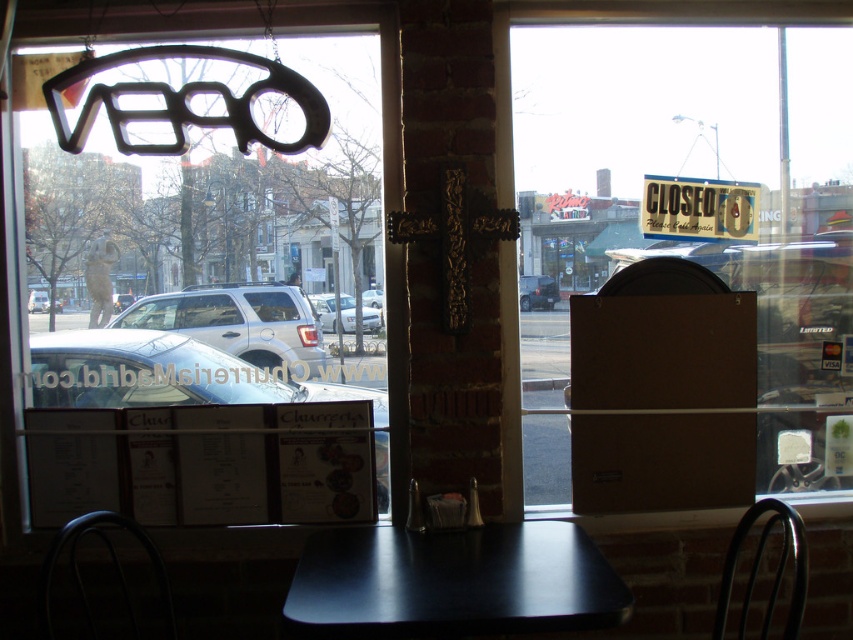
Does wooden sign at center appear on the right side of black metal chair at lower left?

Correct, you'll find wooden sign at center to the right of black metal chair at lower left.

This screenshot has width=853, height=640. I want to click on wooden sign at center, so click(699, 209).

Where is `wooden sign at center`? This screenshot has width=853, height=640. wooden sign at center is located at coordinates (699, 209).

Is point (370, 637) positioned in front of point (157, 556)?

Yes, it is in front of point (157, 556).

Does black matte table at center come in front of black metal chair at lower left?

Yes, it is.

Is point (555, 579) closer to camera compared to point (78, 586)?

That is True.

You are a GUI agent. You are given a task and a screenshot of the screen. Output one action in this format:
    pyautogui.click(x=<x>, y=<y>)
    Task: Click on the black matte table at center
    
    Given the screenshot: What is the action you would take?
    pyautogui.click(x=451, y=582)

Is black matte sign at upper center further to camera compared to black matte table at center?

That is True.

Does black matte sign at upper center appear under black matte table at center?

No.

Measure the distance between black matte sign at upper center and camera.

black matte sign at upper center and camera are 7.39 feet apart from each other.

Locate an element on the screen. This screenshot has width=853, height=640. black matte sign at upper center is located at coordinates (276, 301).